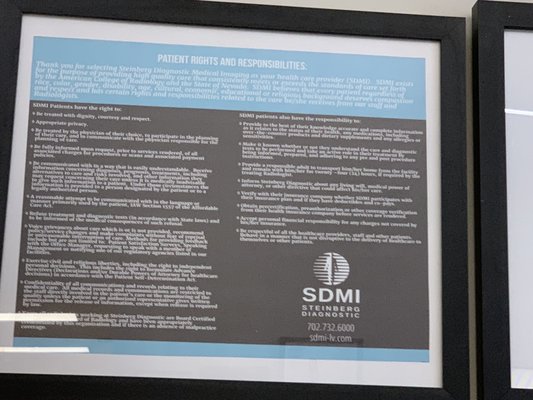
Where is `frame`? This screenshot has width=533, height=400. frame is located at coordinates (239, 122), (487, 290).